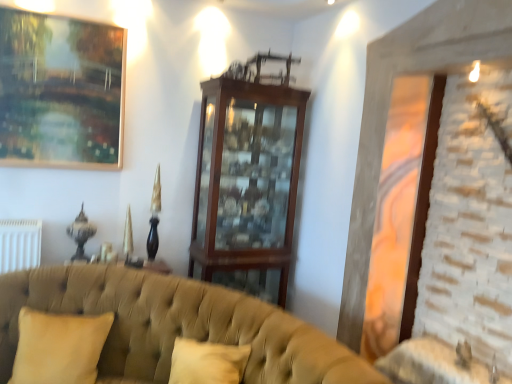
Find the location of a particular element. The image size is (512, 384). beige fabric pillow at lower left is located at coordinates pyautogui.click(x=59, y=347).

Does point (17, 339) come in front of point (79, 349)?

Yes, point (17, 339) is in front of point (79, 349).

From a real-world perspective, is tufted fabric couch at lower left positioned above or below beige fabric pillow at lower left?

tufted fabric couch at lower left is below beige fabric pillow at lower left.

Can you tell me how much tufted fabric couch at lower left and beige fabric pillow at lower left differ in facing direction?

The facing directions of tufted fabric couch at lower left and beige fabric pillow at lower left are 2.19 degrees apart.

The image size is (512, 384). Find the location of `pillow to the left of tufted fabric couch at lower left`. pillow to the left of tufted fabric couch at lower left is located at coordinates (59, 347).

Could you tell me if tufted fabric couch at lower left is facing gold-framed painting at upper left?

No, tufted fabric couch at lower left is not aimed at gold-framed painting at upper left.

Is point (308, 373) farther from camera compared to point (61, 152)?

That is False.

Which of these two, tufted fabric couch at lower left or gold-framed painting at upper left, stands taller?

tufted fabric couch at lower left is taller.

From the image's perspective, which one is positioned lower, tufted fabric couch at lower left or gold-framed painting at upper left?

From the image's view, tufted fabric couch at lower left is below.

From a real-world perspective, is wooden cabinet at center below gold-framed painting at upper left?

Yes, from a real-world perspective, wooden cabinet at center is below gold-framed painting at upper left.

Which object is further away from the camera taking this photo, wooden cabinet at center or gold-framed painting at upper left?

wooden cabinet at center is behind.

Is the surface of wooden cabinet at center in direct contact with gold-framed painting at upper left?

No.

Is wooden cabinet at center positioned with its back to gold-framed painting at upper left?

wooden cabinet at center is not turned away from gold-framed painting at upper left.

Considering the sizes of objects tufted fabric couch at lower left and wooden cabinet at center in the image provided, who is shorter, tufted fabric couch at lower left or wooden cabinet at center?

Standing shorter between the two is tufted fabric couch at lower left.

Is tufted fabric couch at lower left thinner than wooden cabinet at center?

Incorrect, the width of tufted fabric couch at lower left is not less than that of wooden cabinet at center.

What's the angular difference between tufted fabric couch at lower left and wooden cabinet at center's facing directions?

4.62 degrees separate the facing orientations of tufted fabric couch at lower left and wooden cabinet at center.

Could you tell me if tufted fabric couch at lower left is turned towards wooden cabinet at center?

No, tufted fabric couch at lower left is not facing towards wooden cabinet at center.

Is beige fabric pillow at lower left bigger than tufted fabric couch at lower left?

Incorrect, beige fabric pillow at lower left is not larger than tufted fabric couch at lower left.

Which is behind, point (77, 374) or point (196, 284)?

The point (196, 284) is more distant.

Consider the image. From the image's perspective, who appears lower, beige fabric pillow at lower left or tufted fabric couch at lower left?

tufted fabric couch at lower left, from the image's perspective.

Is the position of beige fabric pillow at lower left less distant than that of tufted fabric couch at lower left?

No, the depth of beige fabric pillow at lower left is greater than that of tufted fabric couch at lower left.

Can we say gold-framed painting at upper left lies outside beige fabric pillow at lower left?

Indeed, gold-framed painting at upper left is completely outside beige fabric pillow at lower left.

Considering the points (1, 69) and (70, 316), which point is behind, point (1, 69) or point (70, 316)?

Positioned behind is point (1, 69).

Is gold-framed painting at upper left positioned far away from tufted fabric couch at lower left?

Yes, gold-framed painting at upper left and tufted fabric couch at lower left are quite far apart.

How distant is gold-framed painting at upper left from tufted fabric couch at lower left?

gold-framed painting at upper left and tufted fabric couch at lower left are 1.04 meters apart.

Between point (53, 151) and point (284, 348), which one is positioned in front?

The point (284, 348) is closer.

Does gold-framed painting at upper left have a greater width compared to tufted fabric couch at lower left?

In fact, gold-framed painting at upper left might be narrower than tufted fabric couch at lower left.

The height and width of the screenshot is (384, 512). Identify the location of studio couch that appears below the beige fabric pillow at lower left (from the image's perspective). [175, 325].

You are a GUI agent. You are given a task and a screenshot of the screen. Output one action in this format:
    pyautogui.click(x=<x>, y=<y>)
    Task: Click on the picture frame on the left of the tufted fabric couch at lower left
    The width and height of the screenshot is (512, 384).
    Given the screenshot: What is the action you would take?
    pyautogui.click(x=61, y=91)

Looking at the image, which one is located further to beige fabric pillow at lower left, tufted fabric couch at lower left or gold-framed painting at upper left?

gold-framed painting at upper left.

Estimate the real-world distances between objects in this image. Which object is closer to wooden cabinet at center, gold-framed painting at upper left or tufted fabric couch at lower left?

Among the two, tufted fabric couch at lower left is located nearer to wooden cabinet at center.

Estimate the real-world distances between objects in this image. Which object is further from tufted fabric couch at lower left, wooden cabinet at center or beige fabric pillow at lower left?

wooden cabinet at center.

When comparing their distances from wooden cabinet at center, does tufted fabric couch at lower left or gold-framed painting at upper left seem further?

Based on the image, gold-framed painting at upper left appears to be further to wooden cabinet at center.

Which object lies further to the anchor point tufted fabric couch at lower left, gold-framed painting at upper left or beige fabric pillow at lower left?

The object further to tufted fabric couch at lower left is gold-framed painting at upper left.

Which object lies nearer to the anchor point tufted fabric couch at lower left, gold-framed painting at upper left or wooden cabinet at center?

wooden cabinet at center lies closer to tufted fabric couch at lower left than the other object.

Which object lies nearer to the anchor point gold-framed painting at upper left, wooden cabinet at center or beige fabric pillow at lower left?

Among the two, wooden cabinet at center is located nearer to gold-framed painting at upper left.

Looking at the image, which one is located closer to wooden cabinet at center, tufted fabric couch at lower left or beige fabric pillow at lower left?

The object closer to wooden cabinet at center is tufted fabric couch at lower left.

Locate an element on the screen. Image resolution: width=512 pixels, height=384 pixels. pillow located between tufted fabric couch at lower left and wooden cabinet at center in the depth direction is located at coordinates (59, 347).

Where is `pillow between gold-framed painting at upper left and tufted fabric couch at lower left from top to bottom`? The image size is (512, 384). pillow between gold-framed painting at upper left and tufted fabric couch at lower left from top to bottom is located at coordinates (59, 347).

The image size is (512, 384). Identify the location of dresser between gold-framed painting at upper left and beige fabric pillow at lower left in the vertical direction. (247, 185).

The width and height of the screenshot is (512, 384). Identify the location of picture frame between tufted fabric couch at lower left and wooden cabinet at center in the front-back direction. [61, 91].